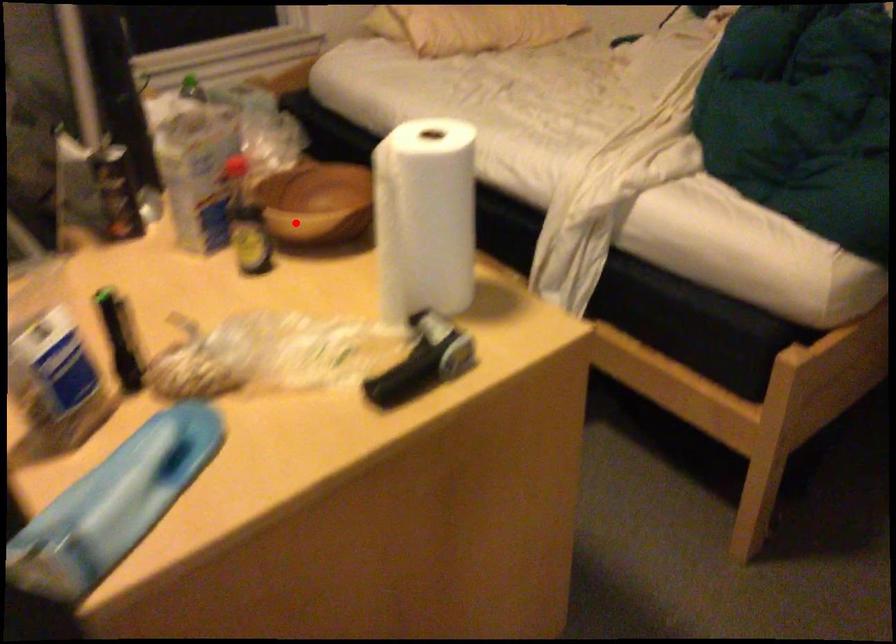
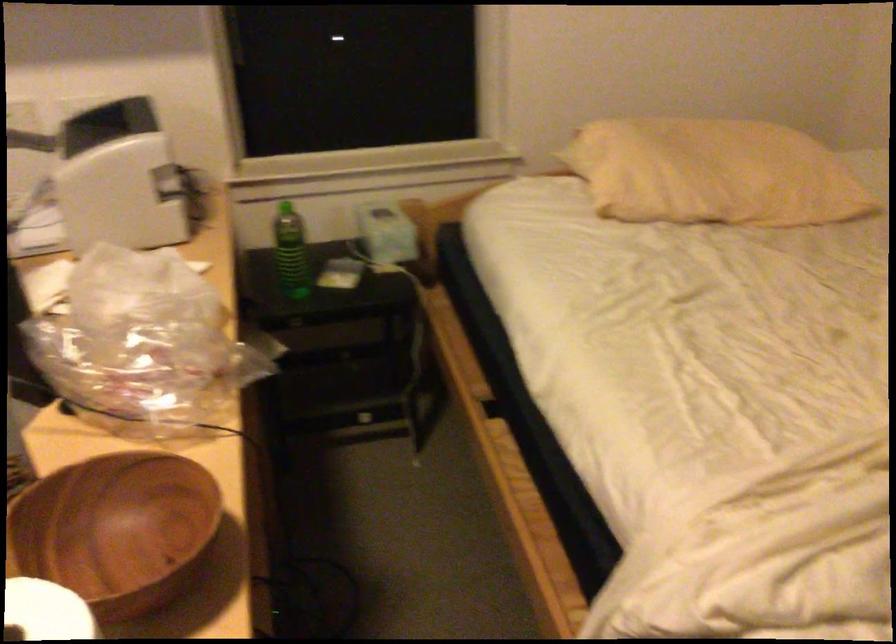
Find the pixel in the second image that matches the highlighted location in the first image.

(117, 529)